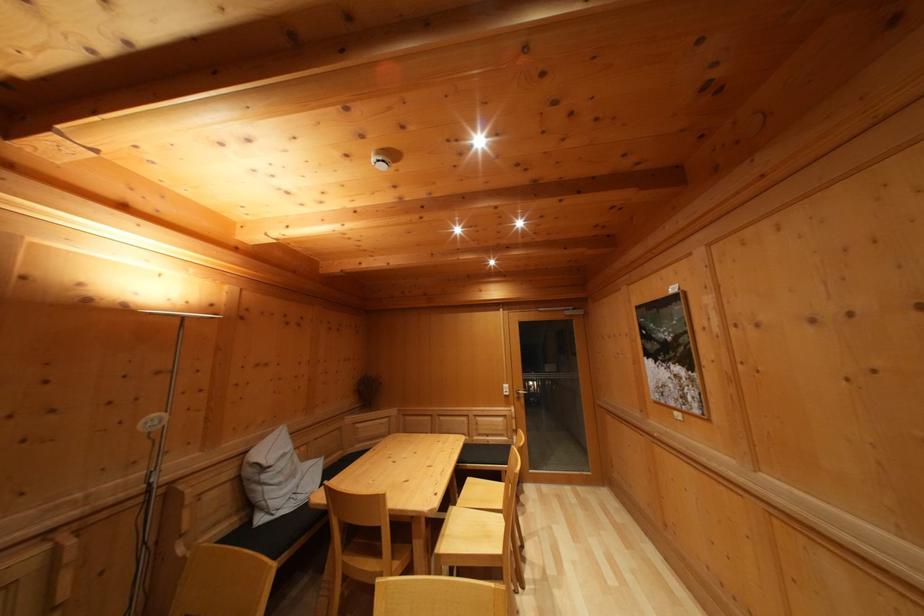
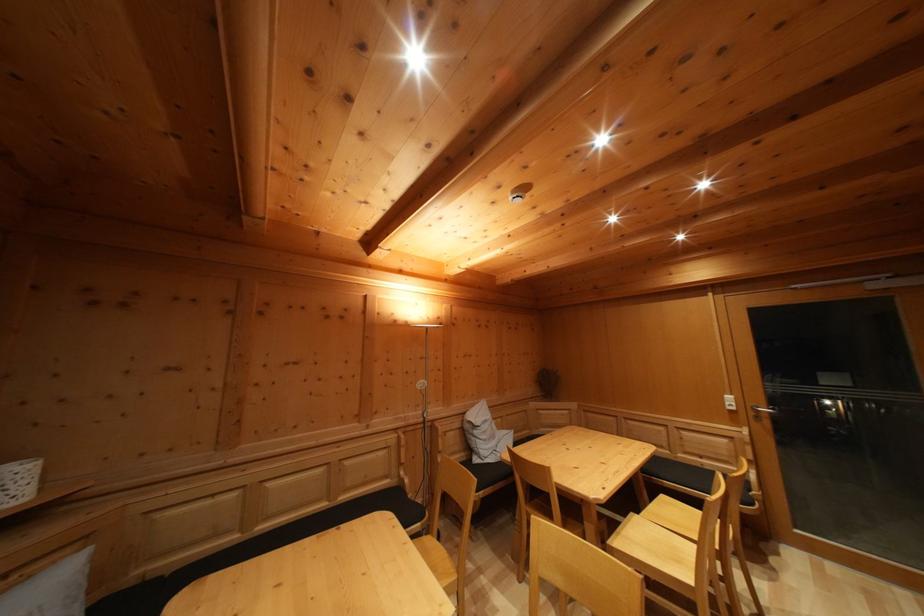
Question: How did the camera likely rotate?

Choices:
 (A) Left
 (B) Right
 (C) Up
 (D) Down

Answer: (A)